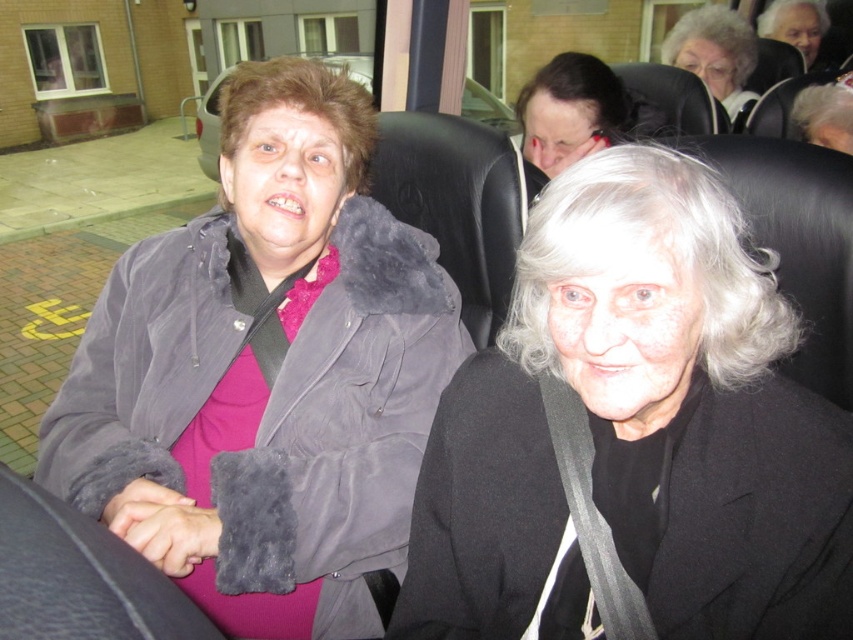
Is black woolen coat at center positioned at the back of gray fuzzy jacket at upper left?

No, black woolen coat at center is in front of gray fuzzy jacket at upper left.

Can you confirm if black woolen coat at center is bigger than gray fuzzy jacket at upper left?

Yes.

Between point (502, 419) and point (200, 131), which one is positioned in front?

Positioned in front is point (502, 419).

Where is `black woolen coat at center`? This screenshot has width=853, height=640. black woolen coat at center is located at coordinates (635, 432).

Is point (173, 342) closer to viewer compared to point (732, 52)?

Yes, point (173, 342) is in front of point (732, 52).

Is velvet-like gray coat at left above gray hair at upper right?

Incorrect, velvet-like gray coat at left is not positioned above gray hair at upper right.

Locate an element on the screen. This screenshot has height=640, width=853. velvet-like gray coat at left is located at coordinates (265, 372).

Which is above, gray hair at upper right or gray fuzzy jacket at upper left?

gray fuzzy jacket at upper left is higher up.

Does point (691, 20) lie in front of point (466, 84)?

Yes, it is in front of point (466, 84).

The width and height of the screenshot is (853, 640). What are the coordinates of `gray hair at upper right` in the screenshot? It's located at (714, 52).